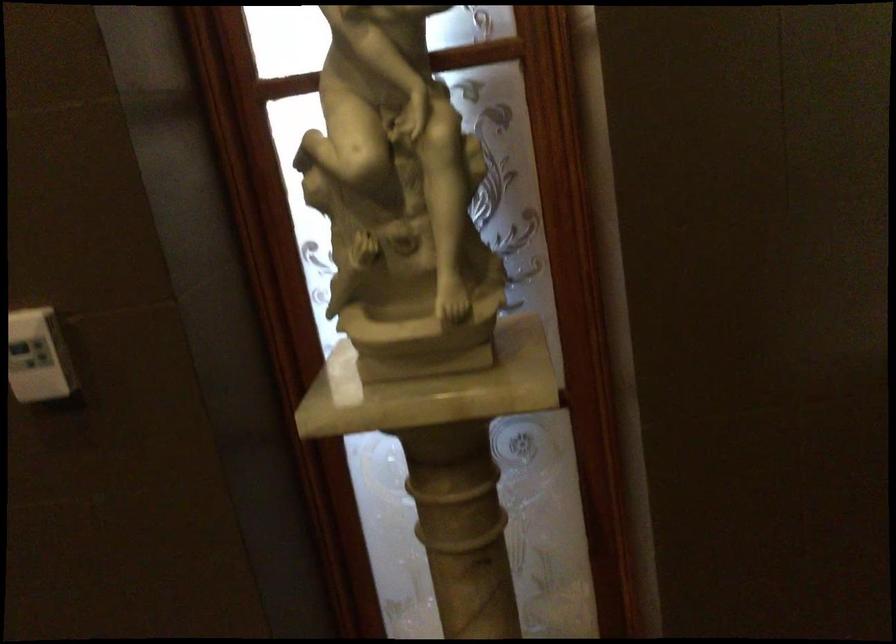
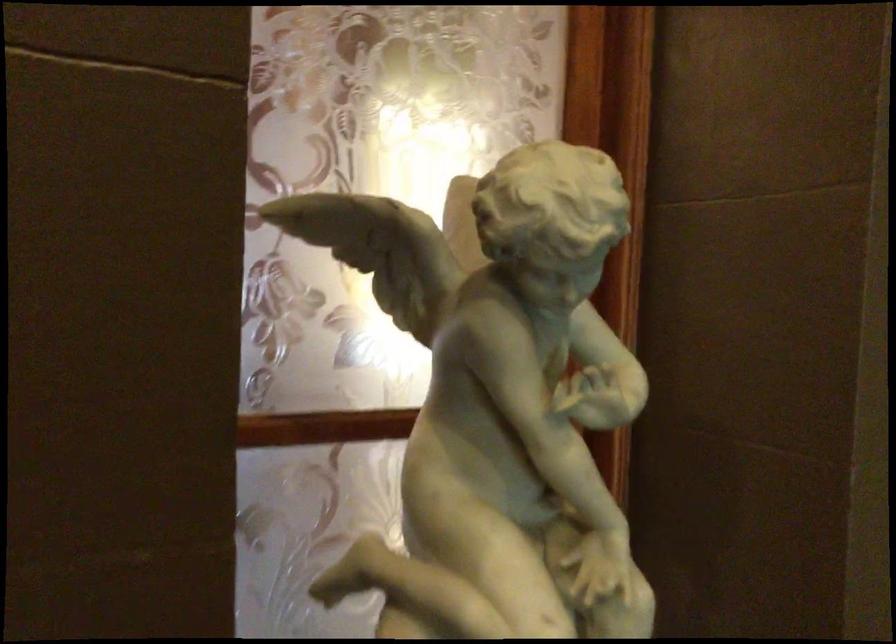
Looking at this image, the images are taken continuously from a first-person perspective. In which direction is your viewpoint rotating?

The rotation direction of the camera is right-up.